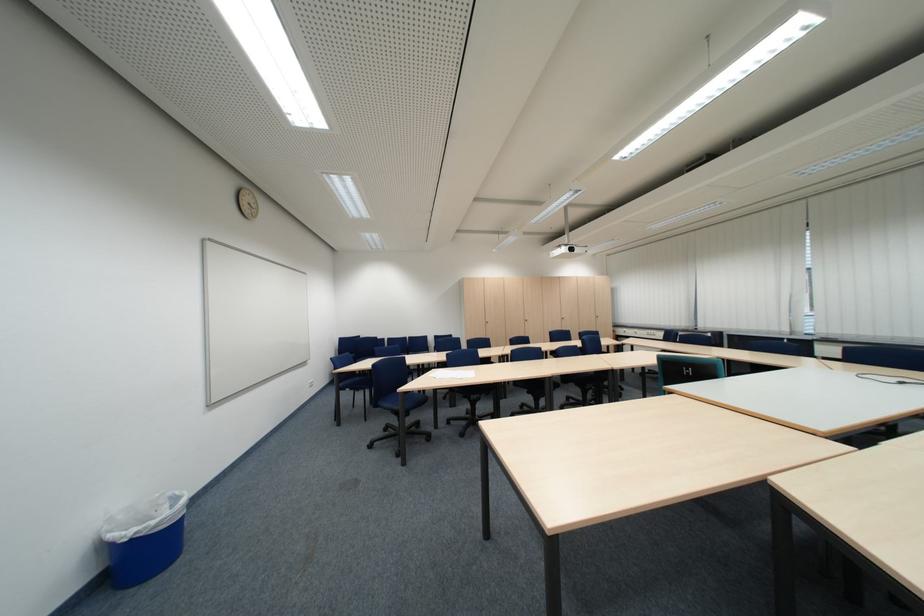
This screenshot has width=924, height=616. Describe the element at coordinates (400, 400) in the screenshot. I see `a blue chair sitting surface` at that location.